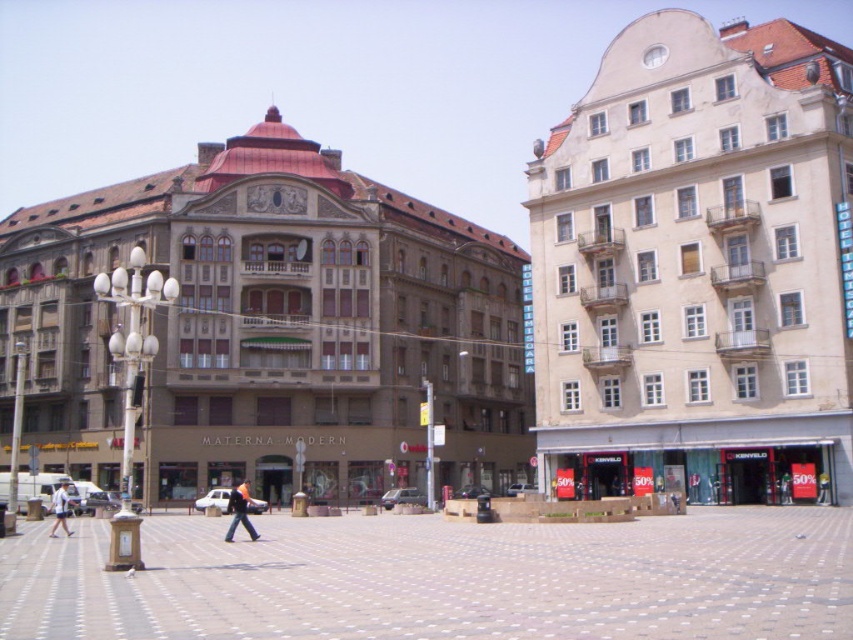
Does denim pants at center appear on the left side of white cotton shirt at center?

In fact, denim pants at center is to the right of white cotton shirt at center.

Does denim pants at center have a lesser width compared to white cotton shirt at center?

Correct, denim pants at center's width is less than white cotton shirt at center's.

Which is behind, point (235, 509) or point (65, 490)?

Positioned behind is point (65, 490).

Identify the location of denim pants at center. This screenshot has width=853, height=640. (239, 512).